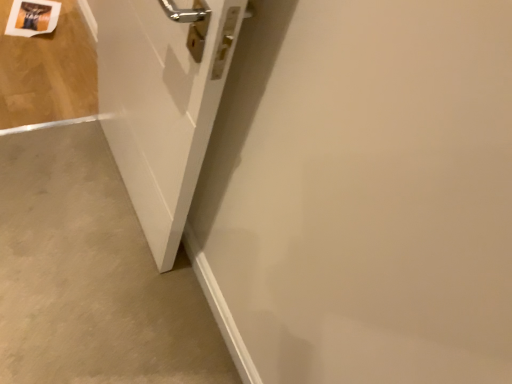
At what (x,y) coordinates should I click in order to perform the action: click on white matte door at center. Please return your answer as a coordinate pair (x, y). Looking at the image, I should click on (162, 101).

Measure the distance between white matte door at center and camera.

white matte door at center and camera are 69.35 centimeters apart.

In order to face white matte door at center, should I rotate leftwards or rightwards?

To face it directly, rotate left by 16.141 degrees.

The width and height of the screenshot is (512, 384). What do you see at coordinates (162, 101) in the screenshot?
I see `white matte door at center` at bounding box center [162, 101].

This screenshot has width=512, height=384. I want to click on white matte door at center, so click(x=162, y=101).